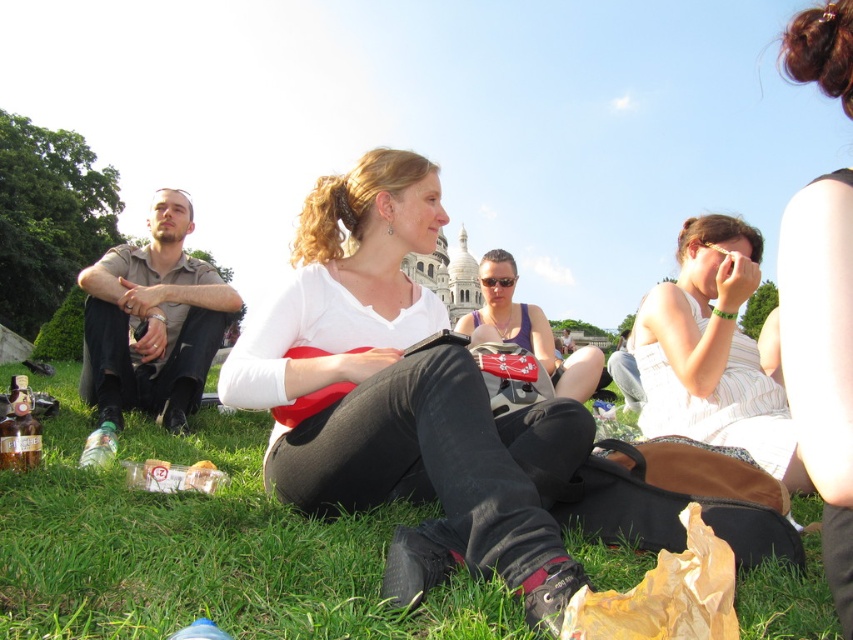
Between green grass at lower center and matte purple tank top at center, which one has more height?

Standing taller between the two is matte purple tank top at center.

Can you confirm if green grass at lower center is positioned to the left of matte purple tank top at center?

Yes, green grass at lower center is to the left of matte purple tank top at center.

Between point (61, 424) and point (579, 387), which one is positioned behind?

The point (579, 387) is more distant.

The image size is (853, 640). I want to click on green grass at lower center, so click(202, 547).

From the picture: Is the position of white striped dress at center less distant than that of matte purple tank top at center?

Yes, it is.

Does white striped dress at center have a lesser width compared to matte purple tank top at center?

Yes, white striped dress at center is thinner than matte purple tank top at center.

You are a GUI agent. You are given a task and a screenshot of the screen. Output one action in this format:
    pyautogui.click(x=<x>, y=<y>)
    Task: Click on the white striped dress at center
    The image size is (853, 640).
    Given the screenshot: What is the action you would take?
    pyautogui.click(x=714, y=353)

Is smooth brown hair at upper right in front of matte purple tank top at center?

Yes.

Is point (840, 588) positioned before point (561, 365)?

Yes, point (840, 588) is in front of point (561, 365).

Is point (808, 253) farther from camera compared to point (552, 337)?

No, it is not.

Image resolution: width=853 pixels, height=640 pixels. In order to click on smooth brown hair at upper right in this screenshot , I will do `click(822, 358)`.